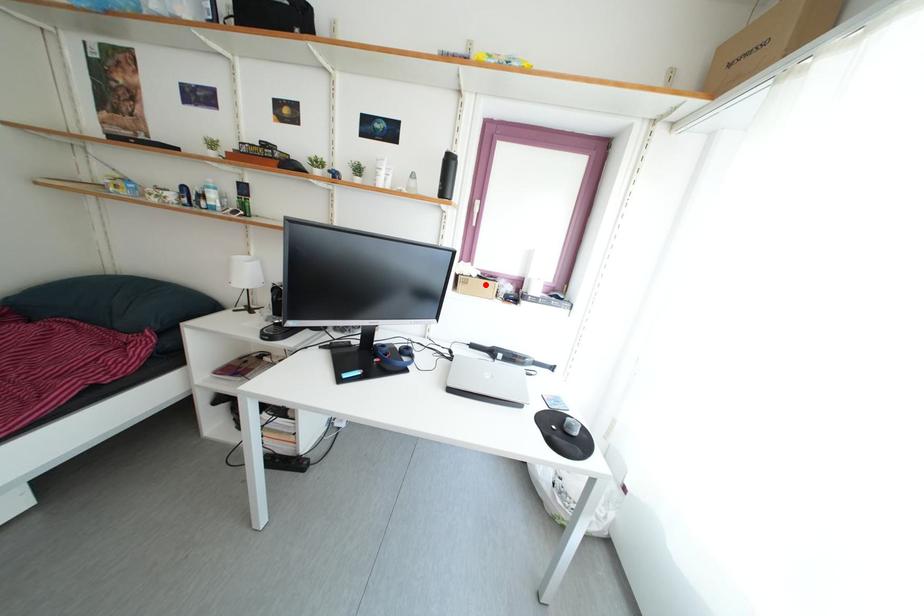
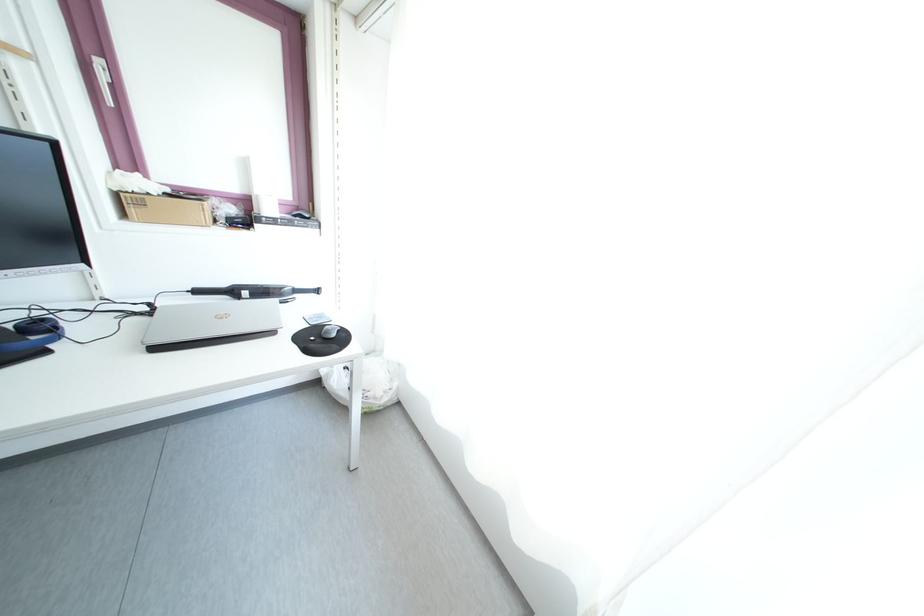
In the second image, find the point that corresponds to the highlighted location in the first image.

(174, 203)